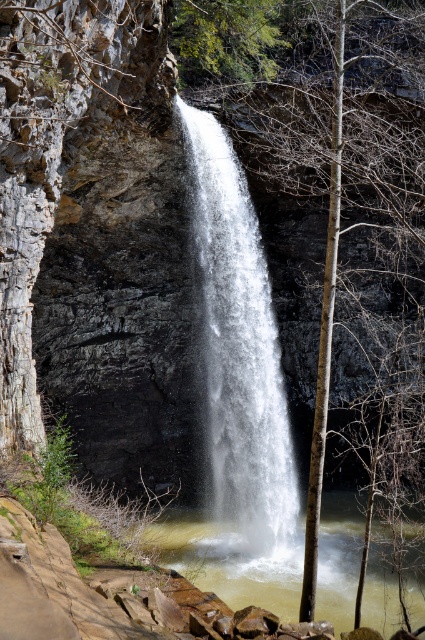
Question: Does white frothy water at center have a lesser width compared to clear water at center?

Choices:
 (A) no
 (B) yes

Answer: (B)

Question: Is white frothy water at center above clear water at center?

Choices:
 (A) no
 (B) yes

Answer: (B)

Question: Which of the following is the closest to the observer?

Choices:
 (A) (294, 609)
 (B) (246, 340)
 (C) (346, 44)

Answer: (A)

Question: Which object is closer to the camera taking this photo?

Choices:
 (A) bare wood tree at center
 (B) white frothy water at center

Answer: (A)

Question: Is white frothy water at center wider than clear water at center?

Choices:
 (A) yes
 (B) no

Answer: (B)

Question: Based on their relative distances, which object is nearer to the clear water at center?

Choices:
 (A) white frothy water at center
 (B) bare wood tree at center

Answer: (A)